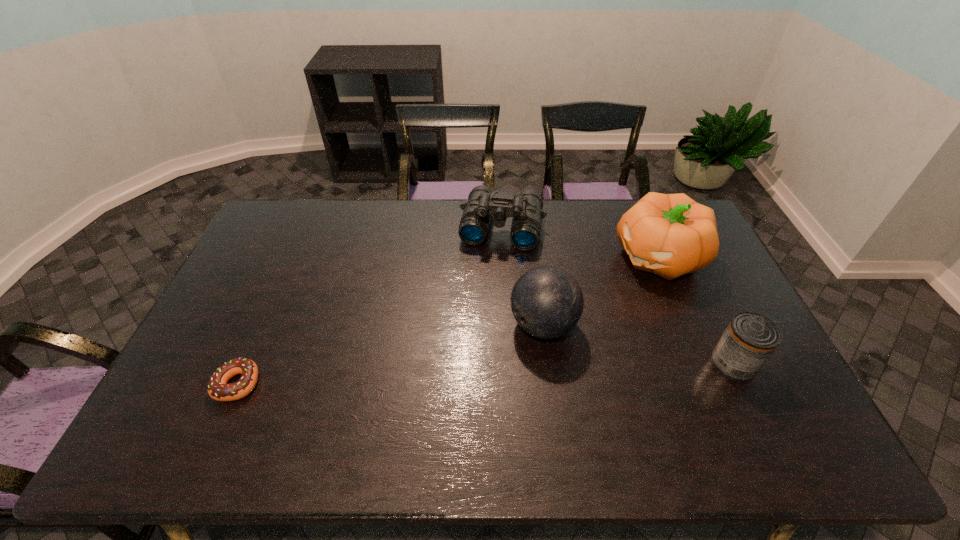
The width and height of the screenshot is (960, 540). Identify the location of blank space located 0.140m on the grip area of the second tallest object. (476, 364).

At what (x,y) coordinates should I click in order to perform the action: click on vacant region located through the lenses of the binoculars. Please return your answer as a coordinate pair (x, y). The width and height of the screenshot is (960, 540). Looking at the image, I should click on (482, 322).

The width and height of the screenshot is (960, 540). What are the coordinates of `free space located through the lenses of the binoculars` in the screenshot? It's located at (487, 300).

Locate an element on the screen. vacant space situated 0.070m through the lenses of the binoculars is located at coordinates (493, 267).

Where is `free space located 0.220m on the carved face of the pumpkin`? The width and height of the screenshot is (960, 540). free space located 0.220m on the carved face of the pumpkin is located at coordinates (580, 305).

At what (x,y) coordinates should I click in order to perform the action: click on vacant space located on the carved face of the pumpkin. Please return your answer as a coordinate pair (x, y). The height and width of the screenshot is (540, 960). Looking at the image, I should click on (575, 308).

You are a GUI agent. You are given a task and a screenshot of the screen. Output one action in this format:
    pyautogui.click(x=<x>, y=<y>)
    Task: Click on the blank space located 0.120m on the carved face of the pumpkin
    The width and height of the screenshot is (960, 540).
    Given the screenshot: What is the action you would take?
    pyautogui.click(x=603, y=292)

The width and height of the screenshot is (960, 540). Identify the location of binoculars at the far edge. (483, 203).

Where is `pumpkin present at the far edge`? pumpkin present at the far edge is located at coordinates (670, 235).

Locate an element on the screen. object at the near edge is located at coordinates (218, 389).